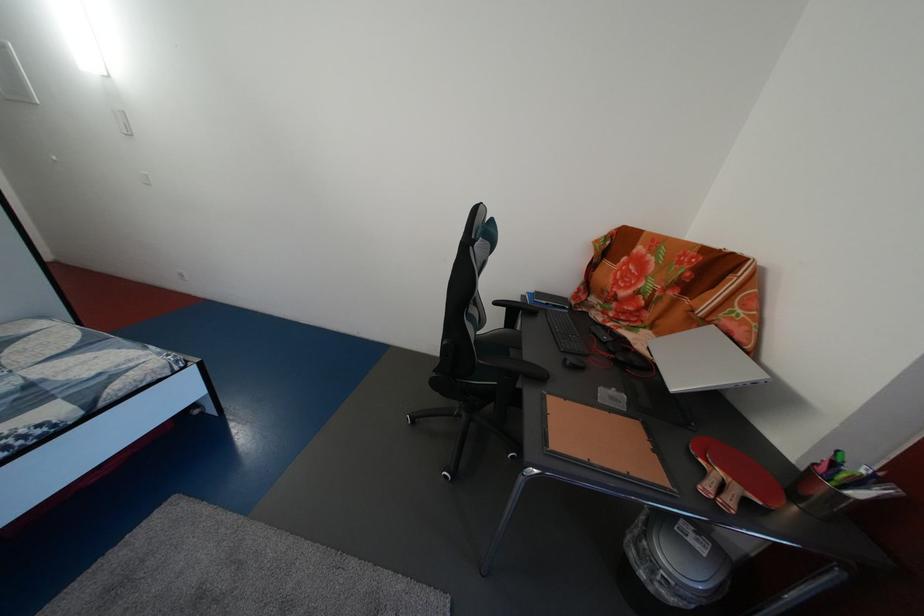
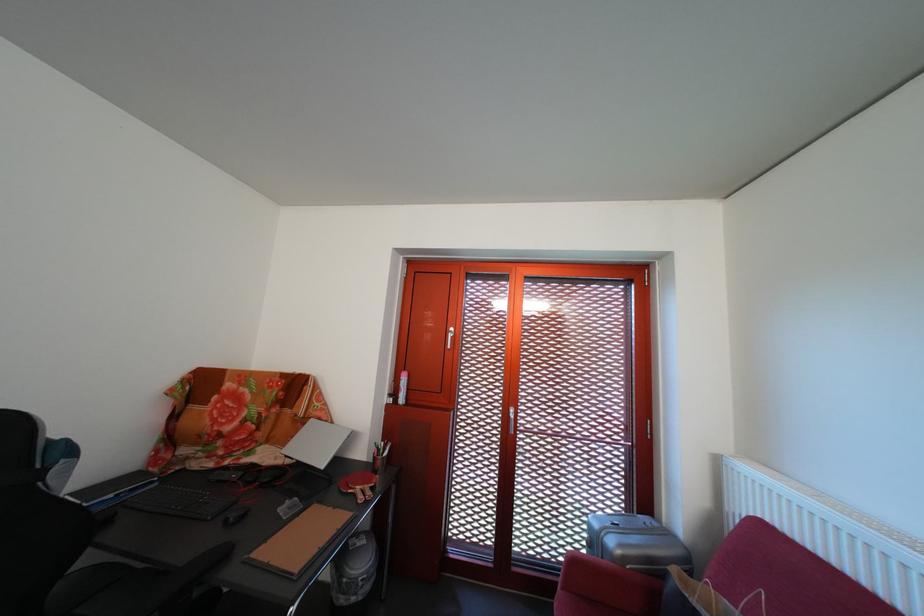
Question: The camera is either moving clockwise (left) or counter-clockwise (right) around the object. The first image is from the beginning of the video and the second image is from the end. Is the camera moving left or right when shooting the video?

Choices:
 (A) Left
 (B) Right

Answer: (A)